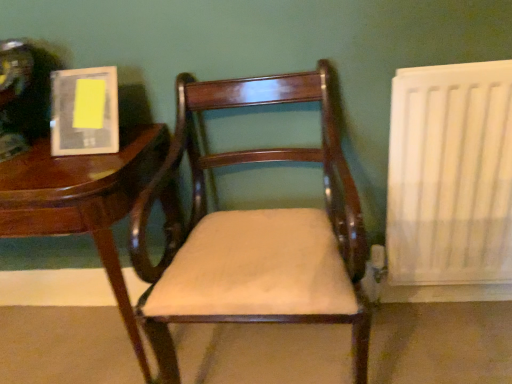
Describe the element at coordinates (450, 175) in the screenshot. I see `white matte radiator at right` at that location.

Find the location of a particular element. The width and height of the screenshot is (512, 384). white matte radiator at right is located at coordinates (450, 175).

Based on the photo, how much distance is there between wooden table at left and matte wood chair at center?

wooden table at left and matte wood chair at center are 8.77 inches apart from each other.

Is point (12, 224) more distant than point (180, 74)?

That is False.

Considering the relative sizes of wooden table at left and matte wood chair at center in the image provided, is wooden table at left taller than matte wood chair at center?

In fact, wooden table at left may be shorter than matte wood chair at center.

Looking at their sizes, would you say wooden table at left is wider or thinner than matte wood chair at center?

Considering their sizes, wooden table at left looks slimmer than matte wood chair at center.

Is wooden table at left in front of white matte radiator at right?

Yes, wooden table at left is closer to the camera.

Is point (126, 328) closer or farther from the camera than point (500, 256)?

Point (126, 328) is positioned closer to the camera compared to point (500, 256).

Between wooden table at left and white matte radiator at right, which one has smaller size?

With smaller size is white matte radiator at right.

What are the coordinates of `table in front of the white matte radiator at right` in the screenshot? It's located at (83, 201).

From a real-world perspective, which is physically below, matte plastic book at upper left or matte wood chair at center?

From a 3D spatial view, matte wood chair at center is below.

Is matte plastic book at upper left not inside matte wood chair at center?

matte plastic book at upper left is positioned outside matte wood chair at center.

Which point is more forward, [85,86] or [348,191]?

Positioned in front is point [348,191].

In the image, is matte plastic book at upper left positioned in front of or behind wooden table at left?

matte plastic book at upper left is behind wooden table at left.

Based on their positions, is matte plastic book at upper left located to the left or right of wooden table at left?

In the image, matte plastic book at upper left appears on the right side of wooden table at left.

Which is closer to the camera, (51, 88) or (158, 124)?

Positioned in front is point (51, 88).

Which object is wider, matte plastic book at upper left or wooden table at left?

Wider between the two is wooden table at left.

Is point (417, 281) closer to camera compared to point (170, 179)?

That is False.

Can you confirm if white matte radiator at right is bigger than matte wood chair at center?

Actually, white matte radiator at right might be smaller than matte wood chair at center.

Image resolution: width=512 pixels, height=384 pixels. Identify the location of radiator located on the right of matte wood chair at center. (450, 175).

Which is further, (x=177, y=297) or (x=474, y=118)?

Positioned behind is point (x=474, y=118).

Are matte wood chair at center and white matte radiator at right located far from each other?

That's not correct — matte wood chair at center is a little close to white matte radiator at right.

From a real-world perspective, who is located lower, matte wood chair at center or white matte radiator at right?

From a 3D spatial view, white matte radiator at right is below.

Is matte wood chair at center taller than white matte radiator at right?

Yes, matte wood chair at center is taller than white matte radiator at right.

From a real-world perspective, which object stands above the other?

From a 3D spatial view, matte plastic book at upper left is above.

Is wooden table at left outside of matte plastic book at upper left?

Yes.

Consider the image. Considering the relative sizes of wooden table at left and matte plastic book at upper left in the image provided, is wooden table at left shorter than matte plastic book at upper left?

No, wooden table at left is not shorter than matte plastic book at upper left.

Considering the points (127, 139) and (69, 100), which point is in front, point (127, 139) or point (69, 100)?

Point (69, 100)

At what (x,y) coordinates should I click in order to perform the action: click on chair above the wooden table at left (from the image's perspective). Please return your answer as a coordinate pair (x, y). The image size is (512, 384). Looking at the image, I should click on 256,232.

I want to click on table in front of the white matte radiator at right, so click(x=83, y=201).

When comparing their distances from wooden table at left, does matte wood chair at center or matte plastic book at upper left seem closer?

matte plastic book at upper left is closer to wooden table at left.

When comparing their distances from matte wood chair at center, does white matte radiator at right or wooden table at left seem further?

white matte radiator at right lies further to matte wood chair at center than the other object.

Estimate the real-world distances between objects in this image. Which object is closer to wooden table at left, matte plastic book at upper left or matte wood chair at center?

Among the two, matte plastic book at upper left is located nearer to wooden table at left.

Based on their spatial positions, is matte plastic book at upper left or white matte radiator at right further from wooden table at left?

white matte radiator at right lies further to wooden table at left than the other object.

Which object lies further to the anchor point wooden table at left, matte wood chair at center or white matte radiator at right?

white matte radiator at right is positioned further to the anchor wooden table at left.

From the image, which object appears to be farther from white matte radiator at right, matte plastic book at upper left or wooden table at left?

matte plastic book at upper left lies further to white matte radiator at right than the other object.

Considering their positions, is white matte radiator at right positioned closer to matte wood chair at center than matte plastic book at upper left?

matte plastic book at upper left is positioned closer to the anchor matte wood chair at center.

From the image, which object appears to be farther from wooden table at left, white matte radiator at right or matte wood chair at center?

white matte radiator at right lies further to wooden table at left than the other object.

Where is `chair located between matte plastic book at upper left and white matte radiator at right in the left-right direction`? chair located between matte plastic book at upper left and white matte radiator at right in the left-right direction is located at coordinates tap(256, 232).

The height and width of the screenshot is (384, 512). I want to click on book between wooden table at left and matte wood chair at center from left to right, so click(84, 111).

At what (x,y) coordinates should I click in order to perform the action: click on chair located between wooden table at left and white matte radiator at right in the left-right direction. Please return your answer as a coordinate pair (x, y). Looking at the image, I should click on [x=256, y=232].

Where is `book situated between wooden table at left and white matte radiator at right from left to right`? This screenshot has width=512, height=384. book situated between wooden table at left and white matte radiator at right from left to right is located at coordinates (84, 111).